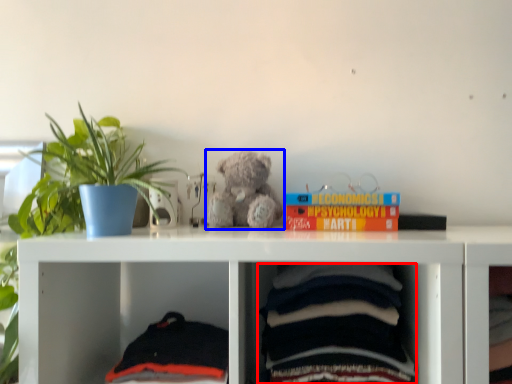
Question: Which object is closer to the camera taking this photo, baby clothe (highlighted by a red box) or teddy bear (highlighted by a blue box)?

Choices:
 (A) baby clothe
 (B) teddy bear

Answer: (A)